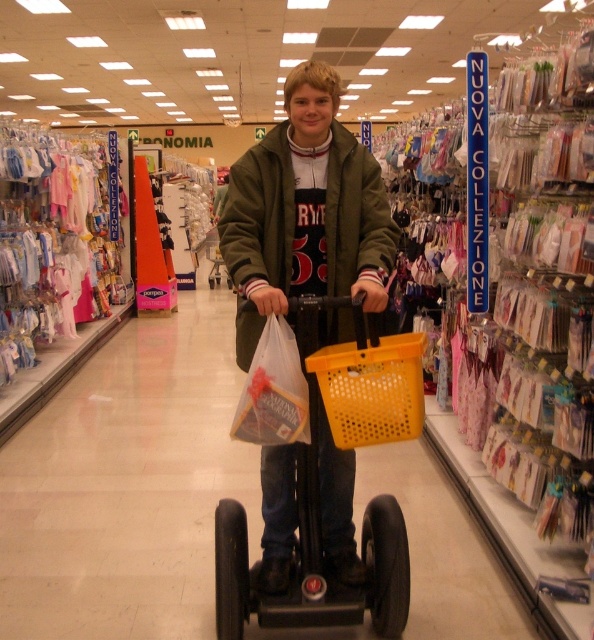
You are a customer in the store and want to place your yellow plastic basket at center onto the yellow plastic scooter at center. Based on their sizes, will the basket fit on the scooter?

The yellow plastic scooter at center has a larger size compared to yellow plastic basket at center, so the basket will fit on the scooter.